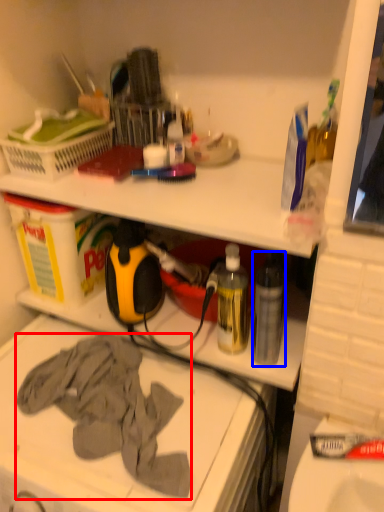
Question: Which of the following is the closest to the observer, clothing (highlighted by a red box) or bottle (highlighted by a blue box)?

Choices:
 (A) clothing
 (B) bottle

Answer: (A)